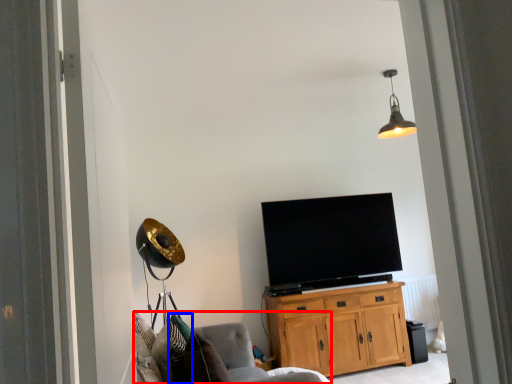
Question: Which object is closer to the camera taking this photo, chair (highlighted by a red box) or pillow (highlighted by a blue box)?

Choices:
 (A) chair
 (B) pillow

Answer: (A)